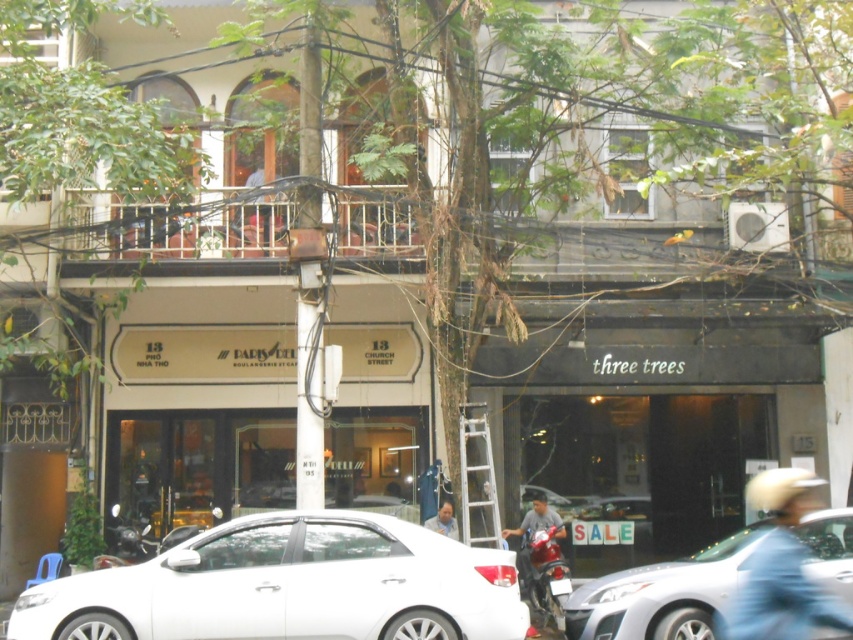
Who is shorter, blue helmet at upper right or white plastic ladder at center?

blue helmet at upper right is shorter.

Is blue helmet at upper right smaller than white plastic ladder at center?

Yes, blue helmet at upper right is smaller than white plastic ladder at center.

Locate an element on the screen. blue helmet at upper right is located at coordinates (780, 568).

This screenshot has width=853, height=640. I want to click on blue helmet at upper right, so click(x=780, y=568).

Can you confirm if white glossy sedan at center is bigger than shiny red motorcycle at lower right?

Indeed, white glossy sedan at center has a larger size compared to shiny red motorcycle at lower right.

Measure the distance between white glossy sedan at center and camera.

white glossy sedan at center and camera are 10.47 meters apart.

The width and height of the screenshot is (853, 640). I want to click on white glossy sedan at center, so click(289, 586).

Who is higher up, white glossy car at lower center or light blue shirt at center?

Positioned higher is light blue shirt at center.

Can you confirm if white glossy car at lower center is taller than light blue shirt at center?

Correct, white glossy car at lower center is much taller as light blue shirt at center.

Where is `white glossy car at lower center`? This screenshot has width=853, height=640. white glossy car at lower center is located at coordinates (662, 595).